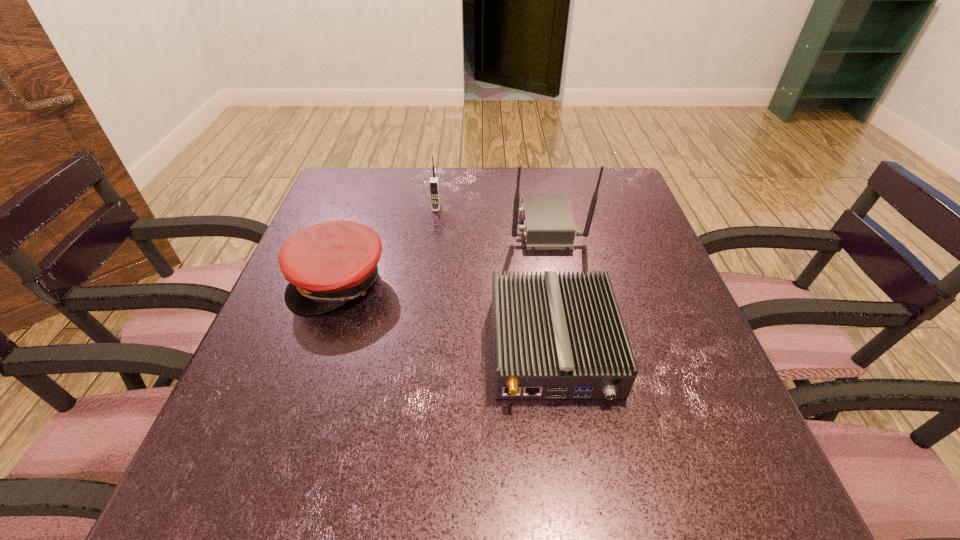
Where is `free space that satisfies the following two spatial constraints: 1. on the back of the farther router to connect cables; 2. on the back panel of the shortest object`? free space that satisfies the following two spatial constraints: 1. on the back of the farther router to connect cables; 2. on the back panel of the shortest object is located at coordinates (568, 347).